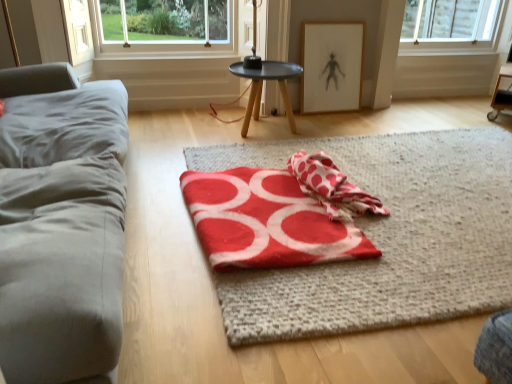
Question: Is red felt beach towel at center, which is the 2th beach towel in right-to-left order, facing away from red polka dot towel at center, which appears as the 1th beach towel when viewed from the right?

Choices:
 (A) no
 (B) yes

Answer: (A)

Question: From a real-world perspective, is red felt beach towel at center, which is the first beach towel in left-to-right order, positioned under red polka dot towel at center, which appears as the 1th beach towel when viewed from the right, based on gravity?

Choices:
 (A) yes
 (B) no

Answer: (A)

Question: Can you see red felt beach towel at center, which is the 2th beach towel in right-to-left order, touching red polka dot towel at center, the 2th beach towel when ordered from left to right?

Choices:
 (A) yes
 (B) no

Answer: (B)

Question: Does red felt beach towel at center, which is the 2th beach towel in right-to-left order, have a greater height compared to red polka dot towel at center, which appears as the 1th beach towel when viewed from the right?

Choices:
 (A) no
 (B) yes

Answer: (A)

Question: From the image's perspective, is red felt beach towel at center, which is the 2th beach towel in right-to-left order, on top of red polka dot towel at center, the 2th beach towel when ordered from left to right?

Choices:
 (A) no
 (B) yes

Answer: (A)

Question: Is red felt beach towel at center, which is the first beach towel in left-to-right order, outside of red polka dot towel at center, the 2th beach towel when ordered from left to right?

Choices:
 (A) no
 (B) yes

Answer: (B)

Question: Does gray fabric couch at left appear on the right side of red woolen blanket at center?

Choices:
 (A) no
 (B) yes

Answer: (A)

Question: Is red woolen blanket at center a part of gray fabric couch at left?

Choices:
 (A) no
 (B) yes

Answer: (A)

Question: Does gray fabric couch at left have a greater height compared to red woolen blanket at center?

Choices:
 (A) no
 (B) yes

Answer: (B)

Question: Is gray fabric couch at left in contact with red woolen blanket at center?

Choices:
 (A) no
 (B) yes

Answer: (A)

Question: Is gray fabric couch at left located outside red woolen blanket at center?

Choices:
 (A) yes
 (B) no

Answer: (A)

Question: Does gray fabric couch at left come in front of red woolen blanket at center?

Choices:
 (A) no
 (B) yes

Answer: (B)

Question: Does red felt beach towel at center, which is the 2th beach towel in right-to-left order, have a greater height compared to red woolen blanket at center?

Choices:
 (A) no
 (B) yes

Answer: (B)